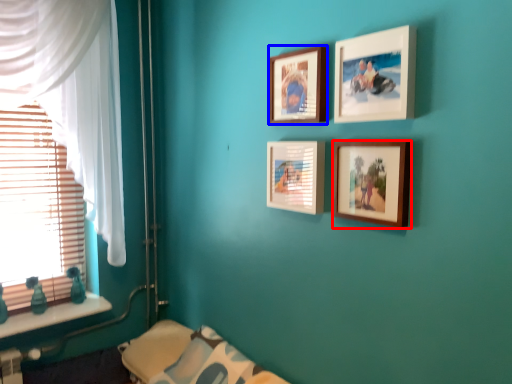
Question: Which point is further to the camera, picture frame (highlighted by a red box) or picture frame (highlighted by a blue box)?

Choices:
 (A) picture frame
 (B) picture frame

Answer: (B)